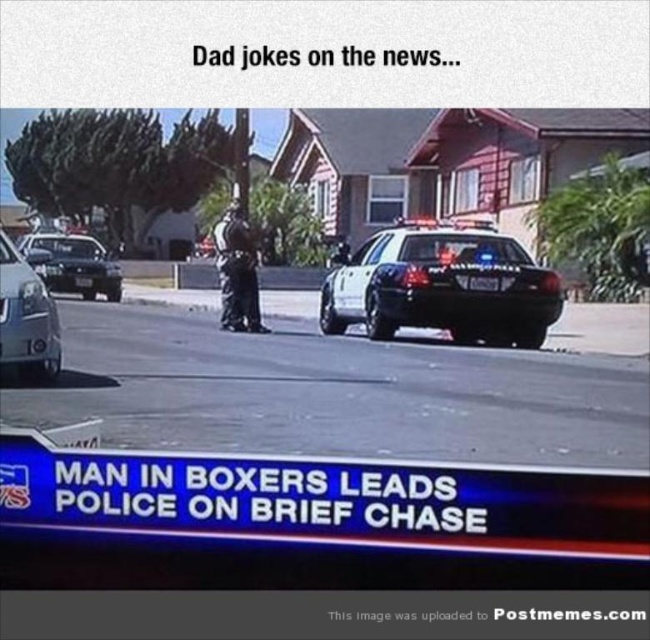
In the meme depicting a news broadcast scene, there is a white glossy police car at center and a dark gray uniform at center. Which object takes up more space in the image?

The white glossy police car at center is larger in size than the dark gray uniform at center, so it takes up more space in the image.